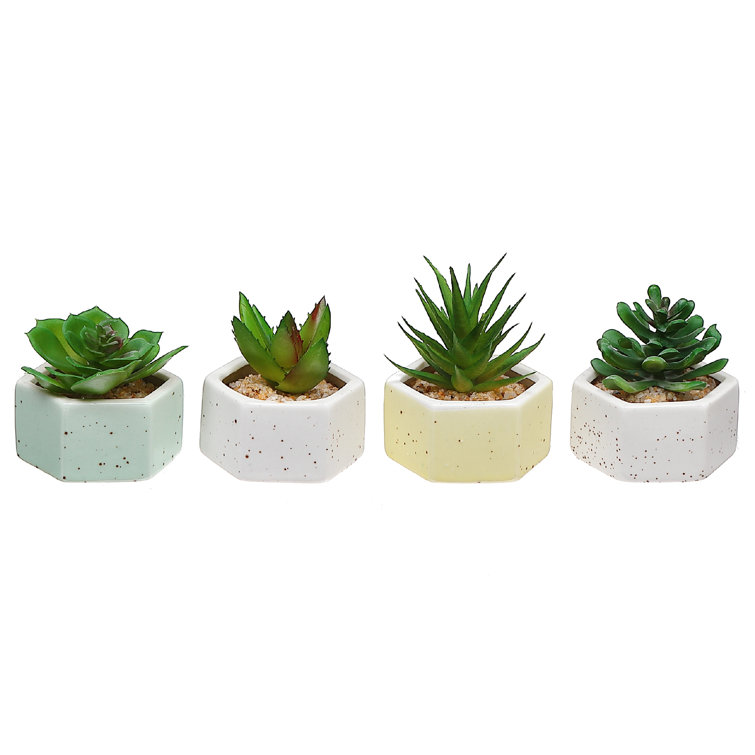
Locate an element on the screen. Image resolution: width=755 pixels, height=755 pixels. darkest planter is located at coordinates (93, 438).